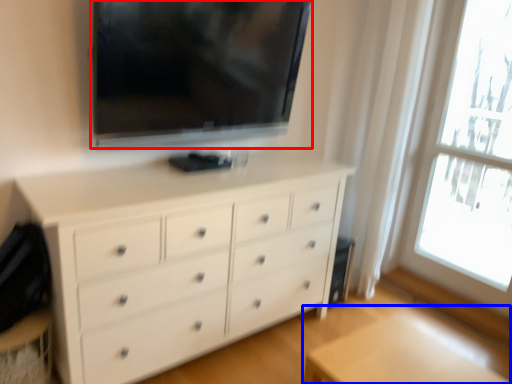
Question: Which object is further to the camera taking this photo, television (highlighted by a red box) or table (highlighted by a blue box)?

Choices:
 (A) television
 (B) table

Answer: (A)